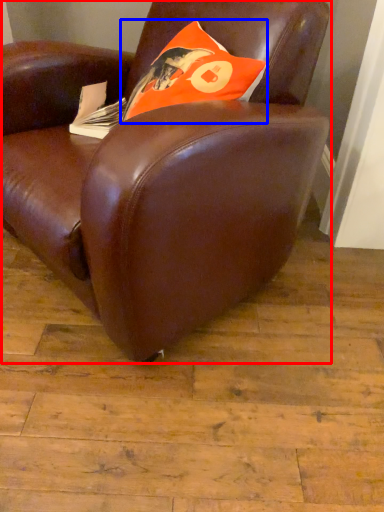
Question: Which object is further to the camera taking this photo, chair (highlighted by a red box) or throw pillow (highlighted by a blue box)?

Choices:
 (A) chair
 (B) throw pillow

Answer: (B)